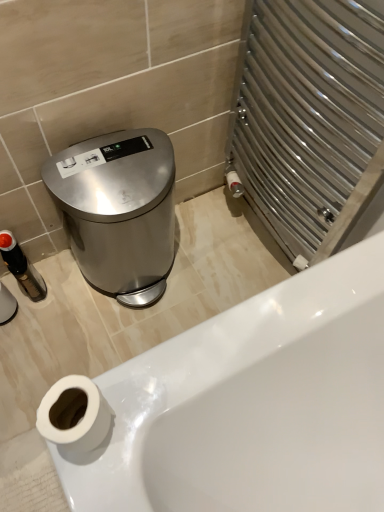
The width and height of the screenshot is (384, 512). In order to click on white glossy bathtub at lower left in this screenshot , I will do `click(252, 405)`.

You are a GUI agent. You are given a task and a screenshot of the screen. Output one action in this format:
    pyautogui.click(x=<x>, y=<y>)
    Task: Click on the polished stainless steel trash can at left
    The width and height of the screenshot is (384, 512).
    Given the screenshot: What is the action you would take?
    pyautogui.click(x=118, y=210)

Locate an element on the screen. white matte toilet paper at lower left is located at coordinates (74, 414).

Identify the location of toilet paper that is above the white glossy bathtub at lower left (from the image's perspective). (74, 414).

Is white glossy bathtub at lower left positioned with its back to white matte toilet paper at lower left?

white glossy bathtub at lower left is not turned away from white matte toilet paper at lower left.

Which of these two, white glossy bathtub at lower left or white matte toilet paper at lower left, stands taller?

white matte toilet paper at lower left is taller.

Is the position of white glossy bathtub at lower left more distant than that of polished stainless steel trash can at left?

That is True.

At what (x,y) coordinates should I click in order to perform the action: click on appliance located in front of the white glossy bathtub at lower left. Please return your answer as a coordinate pair (x, y). Looking at the image, I should click on (118, 210).

From the image's perspective, does white glossy bathtub at lower left appear lower than polished stainless steel trash can at left?

Yes, from the image's perspective, white glossy bathtub at lower left is beneath polished stainless steel trash can at left.

Looking at this image, could you tell me if white glossy bathtub at lower left is turned towards polished stainless steel trash can at left?

No.

At what (x,y) coordinates should I click in order to perform the action: click on bathtub that is on the right side of polished stainless steel trash can at left. Please return your answer as a coordinate pair (x, y). This screenshot has height=512, width=384. Looking at the image, I should click on (252, 405).

Between polished stainless steel trash can at left and white glossy bathtub at lower left, which one has smaller width?

polished stainless steel trash can at left is thinner.

Could you measure the distance between polished stainless steel trash can at left and white glossy bathtub at lower left?

48.69 centimeters.

Is polished stainless steel trash can at left facing away from white glossy bathtub at lower left?

No, polished stainless steel trash can at left is not facing away from white glossy bathtub at lower left.

Does white matte toilet paper at lower left lie behind polished stainless steel trash can at left?

No, white matte toilet paper at lower left is closer to the camera.

Choose the correct answer: Is white matte toilet paper at lower left inside polished stainless steel trash can at left or outside it?

white matte toilet paper at lower left exists outside the volume of polished stainless steel trash can at left.

Considering the sizes of objects white matte toilet paper at lower left and polished stainless steel trash can at left in the image provided, who is shorter, white matte toilet paper at lower left or polished stainless steel trash can at left?

white matte toilet paper at lower left.

Considering the points (78, 440) and (133, 139), which point is in front, point (78, 440) or point (133, 139)?

The point (78, 440) is closer.

Is polished stainless steel trash can at left touching white matte toilet paper at lower left?

No, polished stainless steel trash can at left is not making contact with white matte toilet paper at lower left.

Which is in front, polished stainless steel trash can at left or white matte toilet paper at lower left?

white matte toilet paper at lower left is more forward.

Which is farther from the camera, (150,164) or (104,413)?

The point (150,164) is farther from the camera.

Between polished stainless steel trash can at left and white matte toilet paper at lower left, which one has smaller width?

Thinner between the two is white matte toilet paper at lower left.

Is white matte toilet paper at lower left to the right of white glossy bathtub at lower left from the viewer's perspective?

No, white matte toilet paper at lower left is not to the right of white glossy bathtub at lower left.

Is white matte toilet paper at lower left far away from white glossy bathtub at lower left?

white matte toilet paper at lower left is near white glossy bathtub at lower left, not far away.

Between white matte toilet paper at lower left and white glossy bathtub at lower left, which one has more height?

white matte toilet paper at lower left is taller.

What's the angular difference between white matte toilet paper at lower left and white glossy bathtub at lower left's facing directions?

The facing directions of white matte toilet paper at lower left and white glossy bathtub at lower left are 91.4 degrees apart.

The height and width of the screenshot is (512, 384). In order to click on bathtub on the right of white matte toilet paper at lower left in this screenshot , I will do `click(252, 405)`.

The image size is (384, 512). Find the location of `appliance to the left of white glossy bathtub at lower left`. appliance to the left of white glossy bathtub at lower left is located at coordinates (118, 210).

From the image, which object appears to be farther from polished stainless steel trash can at left, white matte toilet paper at lower left or white glossy bathtub at lower left?

white matte toilet paper at lower left is positioned further to the anchor polished stainless steel trash can at left.

From the image, which object appears to be farther from polished stainless steel trash can at left, white glossy bathtub at lower left or white matte toilet paper at lower left?

white matte toilet paper at lower left.

Based on their spatial positions, is polished stainless steel trash can at left or white matte toilet paper at lower left closer to white glossy bathtub at lower left?

white matte toilet paper at lower left is closer to white glossy bathtub at lower left.

When comparing their distances from white glossy bathtub at lower left, does white matte toilet paper at lower left or polished stainless steel trash can at left seem closer?

white matte toilet paper at lower left lies closer to white glossy bathtub at lower left than the other object.

Estimate the real-world distances between objects in this image. Which object is closer to white matte toilet paper at lower left, white glossy bathtub at lower left or polished stainless steel trash can at left?

white glossy bathtub at lower left is closer to white matte toilet paper at lower left.

Considering their positions, is polished stainless steel trash can at left positioned closer to white matte toilet paper at lower left than white glossy bathtub at lower left?

white glossy bathtub at lower left lies closer to white matte toilet paper at lower left than the other object.

I want to click on appliance located between white matte toilet paper at lower left and white glossy bathtub at lower left in the depth direction, so click(118, 210).